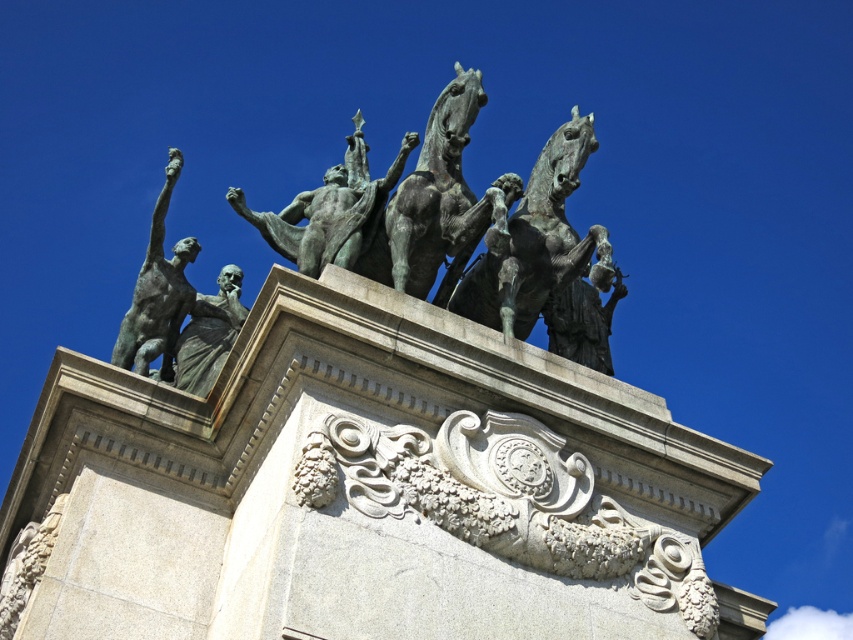
Based on the photo, you are an art student analyzing the statue arrangement in the image. You notice the bronze horse at upper center and the bronze statue at center. Based on their positions, which one is located to the right of the other?

The bronze horse at upper center is positioned on the right side of bronze statue at center, so the bronze horse at upper center is to the right of the bronze statue at center.

You are standing in front of the grand architectural structure and want to determine the relative positions of two specific points marked in the image. Which point, point 1 at coordinates (x=527, y=301) or point 2 at coordinates (x=329, y=184), is closer to you?

Point 1 at coordinates (x=527, y=301) is closer to the viewer than point 2 at coordinates (x=329, y=184).